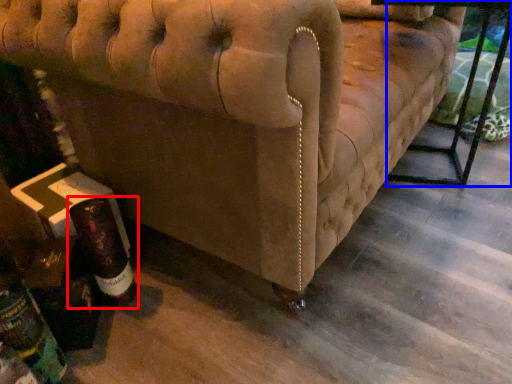
Question: Among these objects, which one is farthest to the camera, bottle (highlighted by a red box) or table (highlighted by a blue box)?

Choices:
 (A) bottle
 (B) table

Answer: (B)